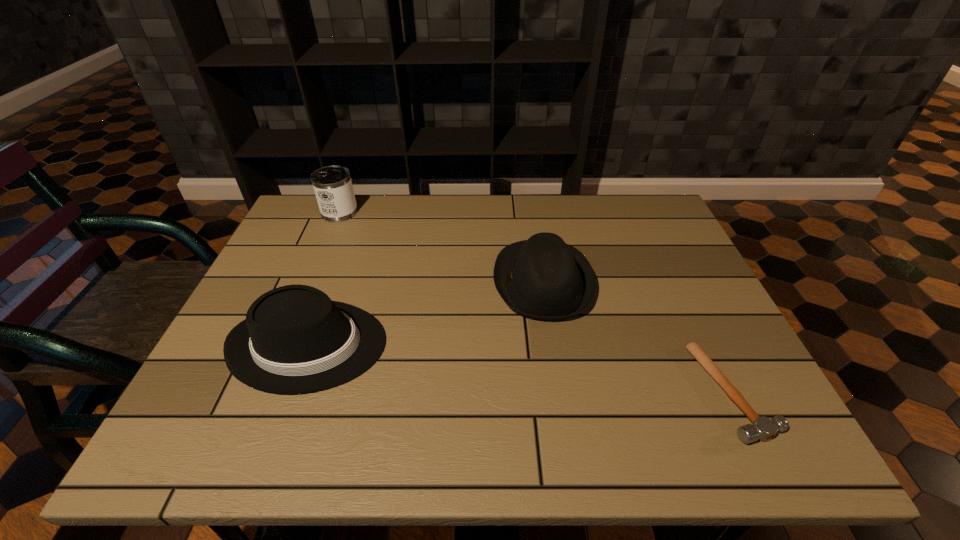
Where is `vacant region at the right edge of the desktop`? The width and height of the screenshot is (960, 540). vacant region at the right edge of the desktop is located at coordinates (633, 252).

In the image, there is a desktop. Where is `blank space at the far left corner`? blank space at the far left corner is located at coordinates click(309, 213).

You are a GUI agent. You are given a task and a screenshot of the screen. Output one action in this format:
    pyautogui.click(x=<x>, y=<y>)
    Task: Click on the free space at the far right corner of the desktop
    Image resolution: width=960 pixels, height=540 pixels.
    Given the screenshot: What is the action you would take?
    pyautogui.click(x=650, y=239)

I want to click on free area in between the rightmost object and the right fedora, so tap(638, 337).

The width and height of the screenshot is (960, 540). I want to click on vacant point located between the can and the third object from left to right, so click(442, 247).

Where is `free space between the second object from right to left and the left fedora`? The image size is (960, 540). free space between the second object from right to left and the left fedora is located at coordinates (426, 314).

Where is `empty space that is in between the right fedora and the left fedora`? empty space that is in between the right fedora and the left fedora is located at coordinates (426, 314).

Find the location of a particular element. This screenshot has width=960, height=540. free spot between the right fedora and the farthest object is located at coordinates (442, 247).

The height and width of the screenshot is (540, 960). Identify the location of vacant region between the right fedora and the hammer. (638, 337).

Where is `free area in between the left fedora and the second object from right to left`? This screenshot has width=960, height=540. free area in between the left fedora and the second object from right to left is located at coordinates (426, 314).